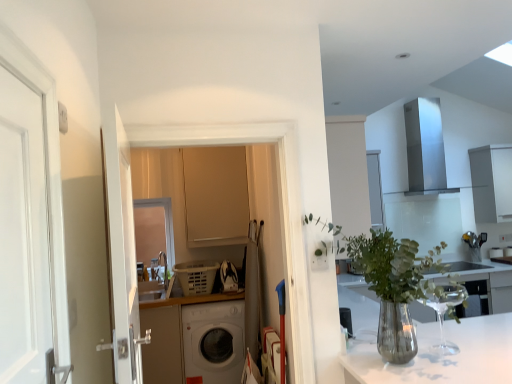
Question: Which direction should I rotate to face matte beige cabinet at center, which is counted as the first cabinetry, starting from the left, — up or down?

Choices:
 (A) down
 (B) up

Answer: (A)

Question: Can you confirm if matte beige cabinet at center, the first cabinetry in the front-to-back sequence, is shorter than translucent glass vase at center?

Choices:
 (A) no
 (B) yes

Answer: (A)

Question: Considering the relative sizes of matte beige cabinet at center, the first cabinetry in the front-to-back sequence, and translucent glass vase at center in the image provided, is matte beige cabinet at center, the first cabinetry in the front-to-back sequence, wider than translucent glass vase at center?

Choices:
 (A) no
 (B) yes

Answer: (A)

Question: Considering the relative sizes of matte beige cabinet at center, the first cabinetry in the front-to-back sequence, and translucent glass vase at center in the image provided, is matte beige cabinet at center, the first cabinetry in the front-to-back sequence, thinner than translucent glass vase at center?

Choices:
 (A) no
 (B) yes

Answer: (B)

Question: Is matte beige cabinet at center, marked as the 2th cabinetry in a right-to-left arrangement, not close to translucent glass vase at center?

Choices:
 (A) yes
 (B) no

Answer: (A)

Question: From the image's perspective, is matte beige cabinet at center, which is the second cabinetry from back to front, under translucent glass vase at center?

Choices:
 (A) no
 (B) yes

Answer: (A)

Question: Considering the relative sizes of matte beige cabinet at center, marked as the 2th cabinetry in a right-to-left arrangement, and translucent glass vase at center in the image provided, is matte beige cabinet at center, marked as the 2th cabinetry in a right-to-left arrangement, bigger than translucent glass vase at center?

Choices:
 (A) no
 (B) yes

Answer: (A)

Question: From the image's perspective, would you say white matte washing machine at center is positioned over white matte cabinet at upper right, which is the first cabinetry from right to left?

Choices:
 (A) no
 (B) yes

Answer: (A)

Question: Considering the relative sizes of white matte washing machine at center and white matte cabinet at upper right, which is the second cabinetry from front to back, in the image provided, is white matte washing machine at center wider than white matte cabinet at upper right, which is the second cabinetry from front to back,?

Choices:
 (A) no
 (B) yes

Answer: (B)

Question: Can we say white matte washing machine at center lies outside white matte cabinet at upper right, which is the second cabinetry from front to back?

Choices:
 (A) yes
 (B) no

Answer: (A)

Question: Is white matte cabinet at upper right, which is counted as the 1th cabinetry, starting from the back, located within white matte washing machine at center?

Choices:
 (A) no
 (B) yes

Answer: (A)

Question: Is white matte washing machine at center shorter than white matte cabinet at upper right, which is the second cabinetry from front to back?

Choices:
 (A) no
 (B) yes

Answer: (A)

Question: Is the position of white matte washing machine at center less distant than that of white matte cabinet at upper right, which is counted as the 1th cabinetry, starting from the back?

Choices:
 (A) yes
 (B) no

Answer: (A)

Question: Considering the relative sizes of white glossy sink at center and matte beige cabinet at center, which is counted as the first cabinetry, starting from the left, in the image provided, is white glossy sink at center bigger than matte beige cabinet at center, which is counted as the first cabinetry, starting from the left,?

Choices:
 (A) yes
 (B) no

Answer: (B)